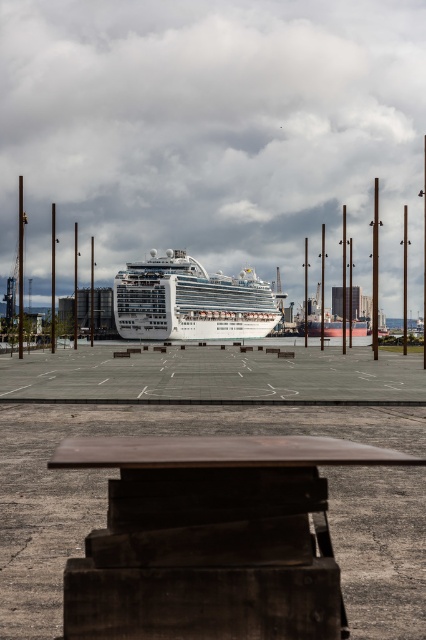
Question: Which of the following is the farthest from the observer?

Choices:
 (A) white glossy cruise ship at center
 (B) dark brown wooden picnic table at center

Answer: (A)

Question: Does dark brown wooden picnic table at center appear on the right side of white glossy cruise ship at center?

Choices:
 (A) no
 (B) yes

Answer: (A)

Question: Does dark brown wooden picnic table at center appear on the left side of white glossy cruise ship at center?

Choices:
 (A) yes
 (B) no

Answer: (A)

Question: Is dark brown wooden picnic table at center wider than white glossy cruise ship at center?

Choices:
 (A) yes
 (B) no

Answer: (B)

Question: Which object appears closest to the camera in this image?

Choices:
 (A) white glossy cruise ship at center
 (B) dark brown wooden picnic table at center

Answer: (B)

Question: Which of the following is the closest to the observer?

Choices:
 (A) (203, 548)
 (B) (132, 291)

Answer: (A)